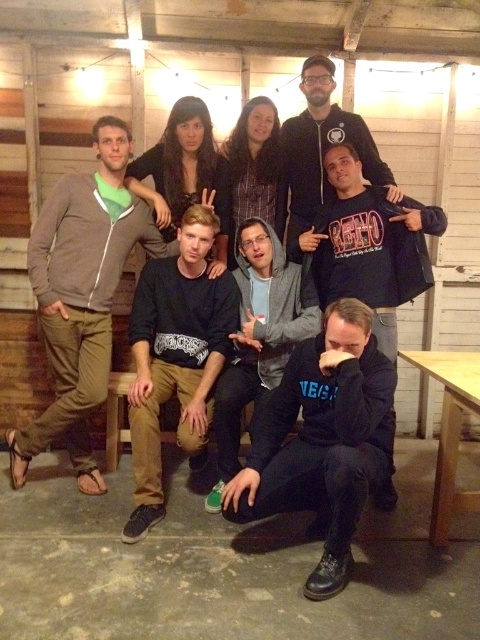
Image resolution: width=480 pixels, height=640 pixels. Describe the element at coordinates (82, 296) in the screenshot. I see `khaki cotton pants at left` at that location.

Does khaki cotton pants at left have a greater height compared to matte black hoodie at upper center?

Yes.

Is point (73, 444) behind point (320, 163)?

No, (73, 444) is closer to viewer.

This screenshot has width=480, height=640. I want to click on khaki cotton pants at left, so click(82, 296).

Does point (67, 320) come closer to viewer compared to point (345, 157)?

Yes, it is in front of point (345, 157).

Is khaki cotton pants at left smaller than black hoodie at lower right?

Actually, khaki cotton pants at left might be larger than black hoodie at lower right.

Which is in front, point (85, 257) or point (373, 234)?

Positioned in front is point (85, 257).

Locate an element on the screen. The width and height of the screenshot is (480, 640). khaki cotton pants at left is located at coordinates (82, 296).

Describe the element at coordinates (323, 440) in the screenshot. The image size is (480, 640). I see `black matte hoodie at lower center` at that location.

Can you confirm if black matte hoodie at lower center is wider than khaki cotton pants at left?

In fact, black matte hoodie at lower center might be narrower than khaki cotton pants at left.

Is point (288, 410) less distant than point (126, 202)?

Yes, it is in front of point (126, 202).

This screenshot has height=640, width=480. Find the location of `black matte hoodie at lower center`. black matte hoodie at lower center is located at coordinates (323, 440).